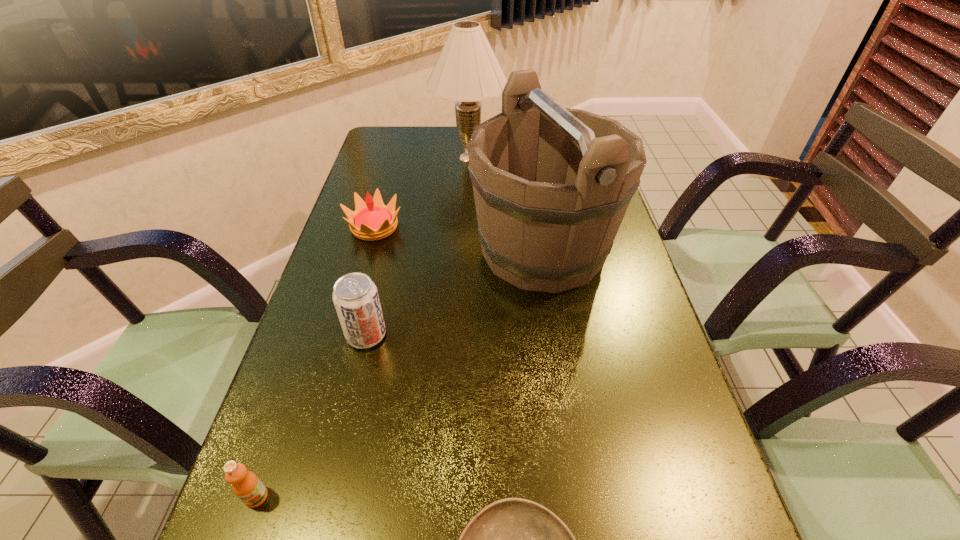
Identify the location of the farthest object. The height and width of the screenshot is (540, 960). (467, 70).

The width and height of the screenshot is (960, 540). I want to click on bucket, so [551, 185].

This screenshot has height=540, width=960. In order to click on the third tallest object in this screenshot , I will do `click(355, 296)`.

You are a GUI agent. You are given a task and a screenshot of the screen. Output one action in this format:
    pyautogui.click(x=<x>, y=<y>)
    Task: Click on the soda can
    The image size is (960, 540).
    Given the screenshot: What is the action you would take?
    pyautogui.click(x=355, y=296)

You are a GUI agent. You are given a task and a screenshot of the screen. Output one action in this format:
    pyautogui.click(x=<x>, y=<y>)
    Task: Click on the crown
    The width and height of the screenshot is (960, 540).
    Given the screenshot: What is the action you would take?
    pyautogui.click(x=372, y=220)

At what (x,y) coordinates should I click in order to perform the action: click on the fifth farthest object. Please return your answer as a coordinate pair (x, y). The image size is (960, 540). Looking at the image, I should click on (246, 485).

The image size is (960, 540). I want to click on blank space located on the right of the lampshade, so point(562,158).

The image size is (960, 540). I want to click on free location located 0.160m on the back of the bucket, so click(531, 177).

You are a GUI agent. You are given a task and a screenshot of the screen. Output one action in this format:
    pyautogui.click(x=<x>, y=<y>)
    Task: Click on the vacant point located on the right of the fourth farthest object
    The height and width of the screenshot is (540, 960).
    Given the screenshot: What is the action you would take?
    pyautogui.click(x=468, y=335)

The image size is (960, 540). What are the coordinates of `vacant space located on the right of the crown` in the screenshot? It's located at (472, 227).